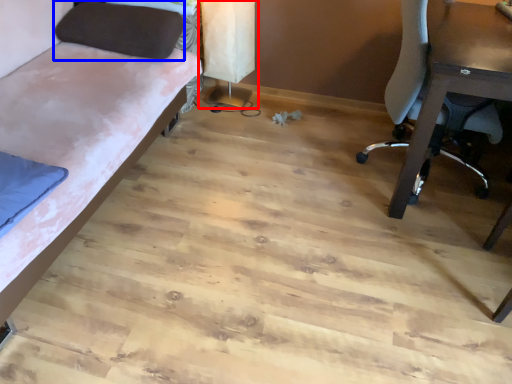
Question: Which point is further to the camera, table lamp (highlighted by a red box) or pillow (highlighted by a blue box)?

Choices:
 (A) table lamp
 (B) pillow

Answer: (A)